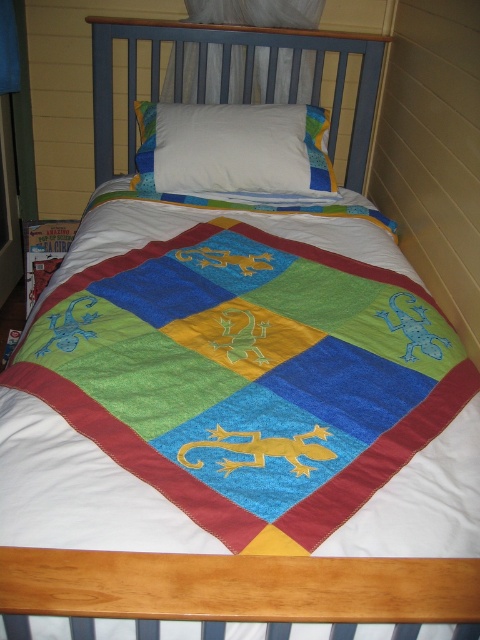
Which is behind, point (109, 77) or point (240, 134)?

Point (109, 77)

Is blue painted wood headboard at upper center wider than white soft pillow at center?

Yes, blue painted wood headboard at upper center is wider than white soft pillow at center.

Is point (372, 52) positioned in front of point (177, 120)?

No.

I want to click on blue painted wood headboard at upper center, so click(228, 76).